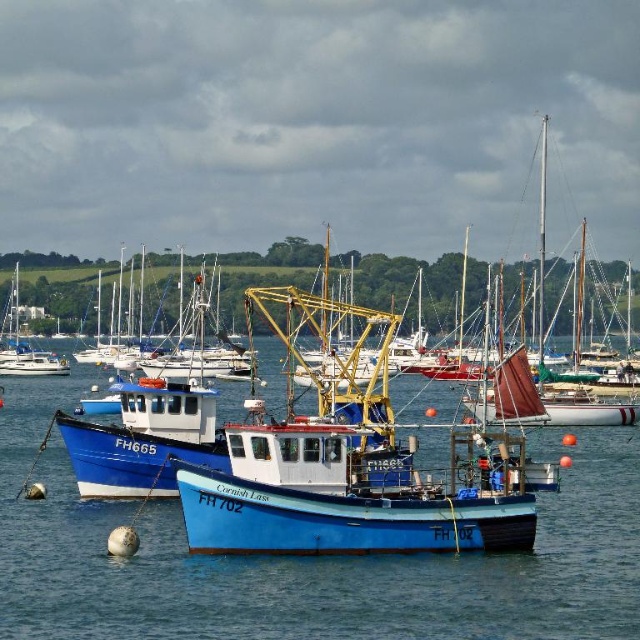
Question: Is blue wooden water at center below blue painted wooden fishing boat at center?

Choices:
 (A) no
 (B) yes

Answer: (B)

Question: Which of the following is the farthest from the observer?

Choices:
 (A) (4, 540)
 (B) (508, 492)

Answer: (A)

Question: Which point is closer to the camera?

Choices:
 (A) blue painted wooden fishing boat at center
 (B) blue wooden water at center

Answer: (B)

Question: Is blue wooden water at center smaller than blue painted wooden fishing boat at center?

Choices:
 (A) yes
 (B) no

Answer: (A)

Question: Which point is closer to the camera?

Choices:
 (A) (384, 508)
 (B) (618, 516)

Answer: (A)

Question: Does blue wooden water at center appear under blue painted wooden fishing boat at center?

Choices:
 (A) yes
 (B) no

Answer: (A)